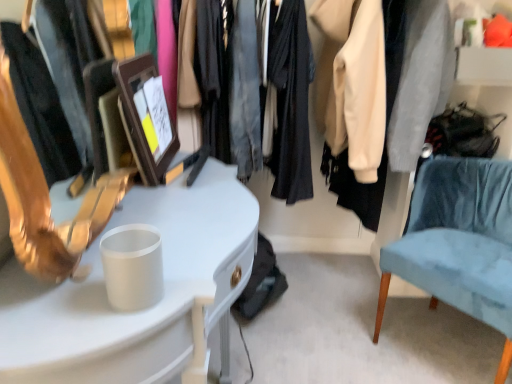
I want to click on free space that is to the left of velvet blue chair at right, so click(330, 331).